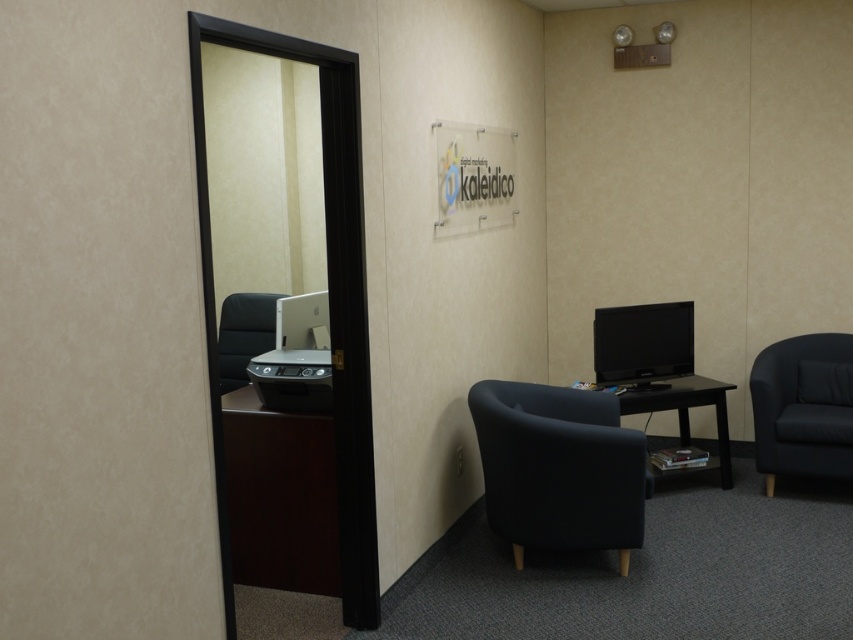
Is black fabric swivel chair at right shorter than black wood table at center?

No, black fabric swivel chair at right is not shorter than black wood table at center.

Which is more to the left, black fabric swivel chair at right or black wood table at center?

From the viewer's perspective, black wood table at center appears more on the left side.

Where is `black fabric swivel chair at right`? This screenshot has width=853, height=640. black fabric swivel chair at right is located at coordinates (804, 406).

Is the position of dark blue fabric armchair at lower center less distant than that of white glossy printer at center?

No, it is behind white glossy printer at center.

Is point (560, 548) farther from camera compared to point (257, 381)?

Yes.

The height and width of the screenshot is (640, 853). What are the coordinates of `dark blue fabric armchair at lower center` in the screenshot? It's located at (558, 468).

Which of these two, white glossy printer at center or matte black monitor at right, stands taller?

With more height is white glossy printer at center.

Is white glossy printer at center bigger than matte black monitor at right?

Correct, white glossy printer at center is larger in size than matte black monitor at right.

Locate an element on the screen. white glossy printer at center is located at coordinates (296, 356).